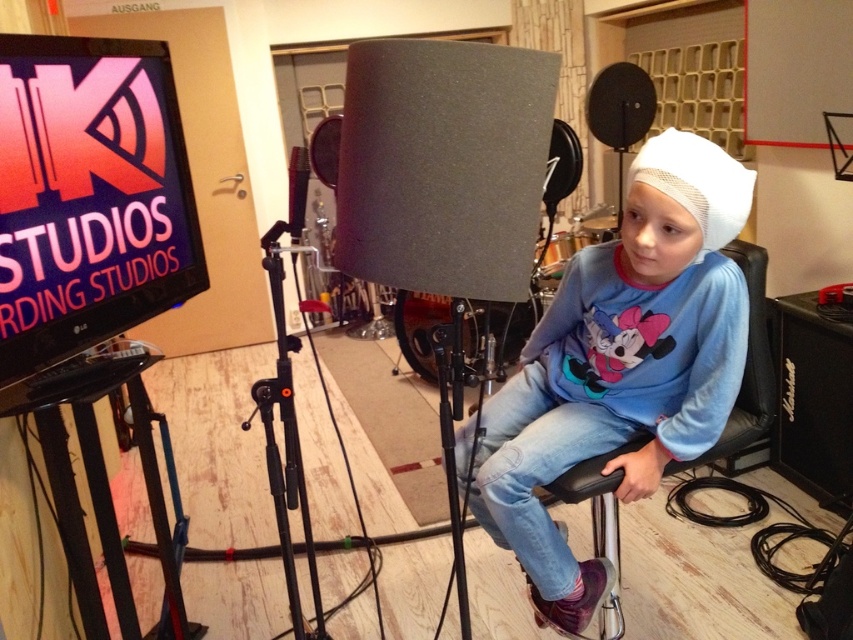
Question: Which object is closer to the camera taking this photo?

Choices:
 (A) black metal tripod at center
 (B) white mesh hat at center

Answer: (A)

Question: Can you confirm if white mesh hat at center is wider than black metal tripod at center?

Choices:
 (A) no
 (B) yes

Answer: (B)

Question: Is white mesh hat at center further to the viewer compared to black metal tripod at center?

Choices:
 (A) yes
 (B) no

Answer: (A)

Question: Can you confirm if white mesh hat at center is wider than black metal tripod at center?

Choices:
 (A) yes
 (B) no

Answer: (A)